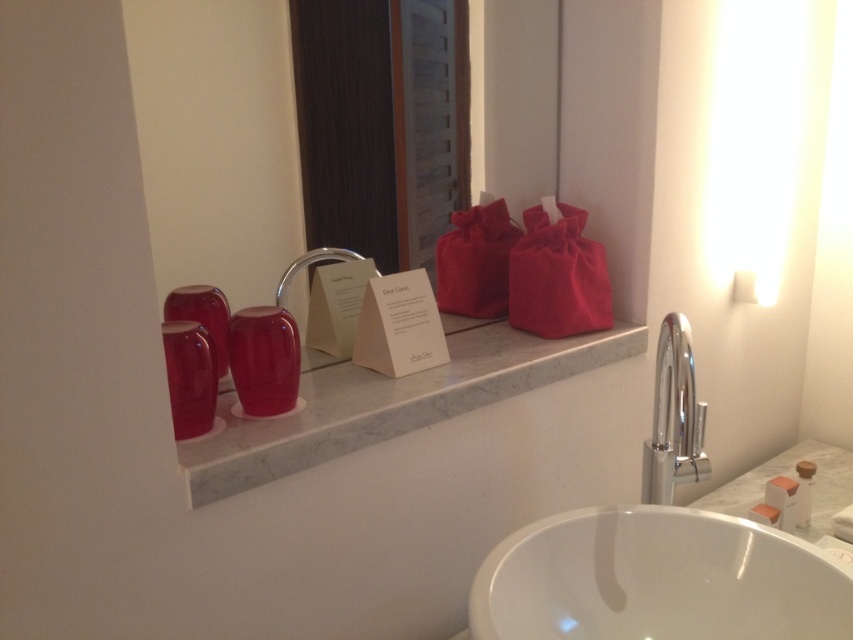
Question: Is matte glass mirror at upper center in front of chrome/metallic faucet at lower center?

Choices:
 (A) no
 (B) yes

Answer: (B)

Question: Is chrome/metallic faucet at lower center to the right of matte red bag at center from the viewer's perspective?

Choices:
 (A) no
 (B) yes

Answer: (B)

Question: Among these points, which one is farthest from the camera?

Choices:
 (A) (534, 305)
 (B) (811, 465)
 (C) (675, 396)
 (D) (270, 86)

Answer: (B)

Question: Which object appears farthest from the camera in this image?

Choices:
 (A) glossy plastic toiletry at left
 (B) white glossy sink at lower center

Answer: (A)

Question: Is polished chrome faucet at center closer to the viewer compared to translucent plastic soap at lower right?

Choices:
 (A) no
 (B) yes

Answer: (B)

Question: Which object is farther from the camera taking this photo?

Choices:
 (A) glossy plastic toiletries at center
 (B) polished chrome faucet at center
 (C) matte glass mirror at upper center
 (D) chrome/metallic faucet at lower center

Answer: (B)